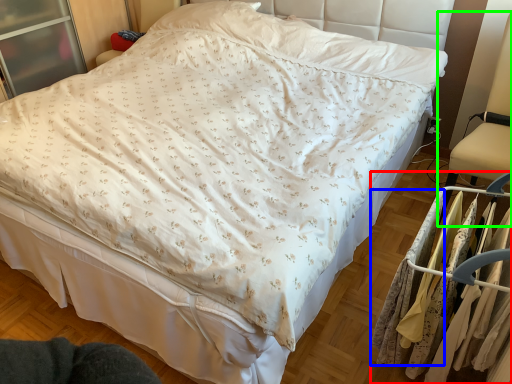
Question: Estimate the real-world distances between objects in this image. Which object is farther from closet (highlighted by a red box), clothing (highlighted by a blue box) or swivel chair (highlighted by a green box)?

Choices:
 (A) clothing
 (B) swivel chair

Answer: (B)